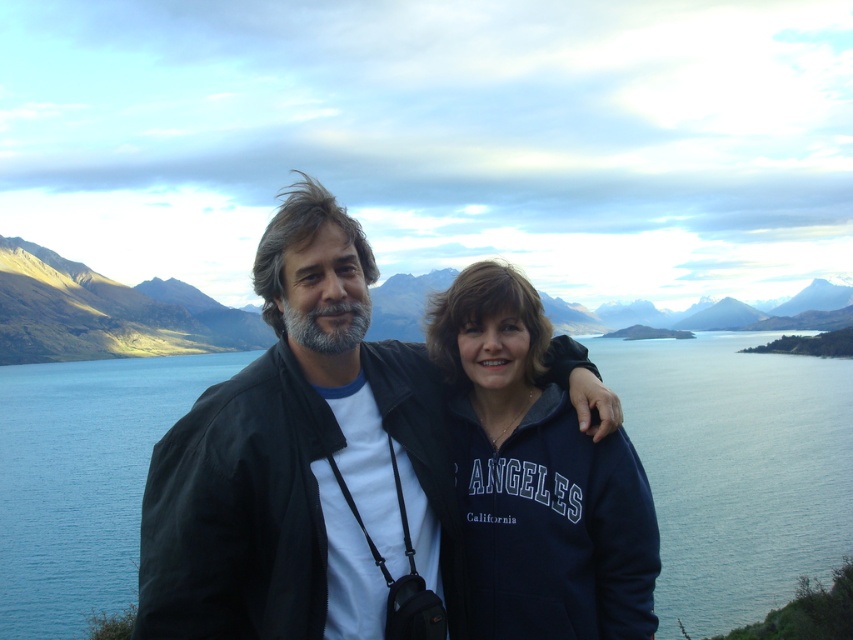
Can you confirm if dark blue jacket at center is wider than navy blue fleece at center?

Correct, the width of dark blue jacket at center exceeds that of navy blue fleece at center.

At what (x,y) coordinates should I click in order to perform the action: click on dark blue jacket at center. Please return your answer as a coordinate pair (x, y). The width and height of the screenshot is (853, 640). Looking at the image, I should click on (303, 461).

Identify the location of dark blue jacket at center. (303, 461).

Can you confirm if dark blue jacket at center is positioned above blue water at center?

Indeed, dark blue jacket at center is positioned over blue water at center.

Is dark blue jacket at center bigger than blue water at center?

No.

Is point (339, 579) less distant than point (109, 529)?

Yes, it is.

At what (x,y) coordinates should I click in order to perform the action: click on dark blue jacket at center. Please return your answer as a coordinate pair (x, y). Looking at the image, I should click on (303, 461).

Is blue water at center to the left of navy blue fleece at center from the viewer's perspective?

Correct, you'll find blue water at center to the left of navy blue fleece at center.

Measure the distance between point [746,509] and camera.

Point [746,509] and camera are 164.22 meters apart.

What are the coordinates of `blue water at center` in the screenshot? It's located at (735, 468).

The image size is (853, 640). In order to click on blue water at center in this screenshot , I will do `click(735, 468)`.